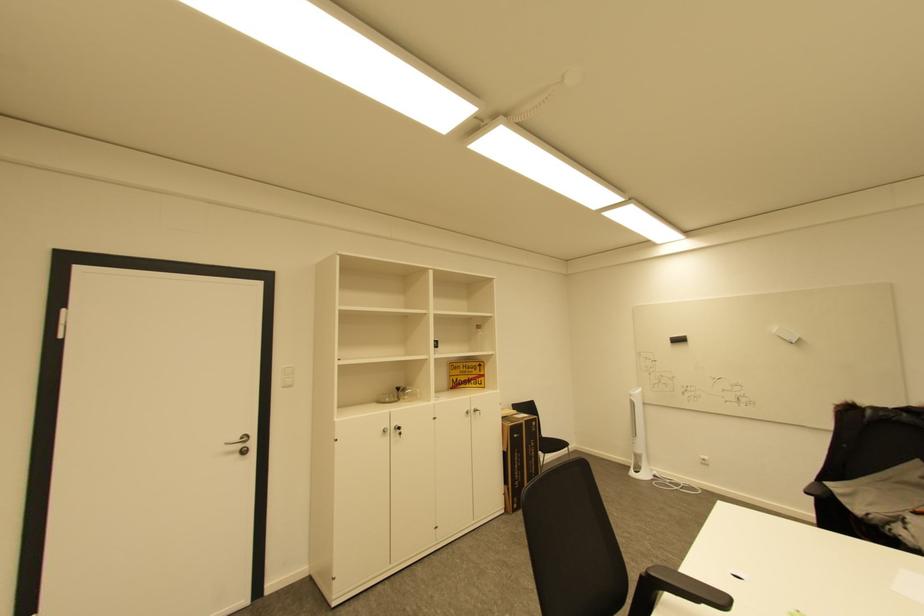
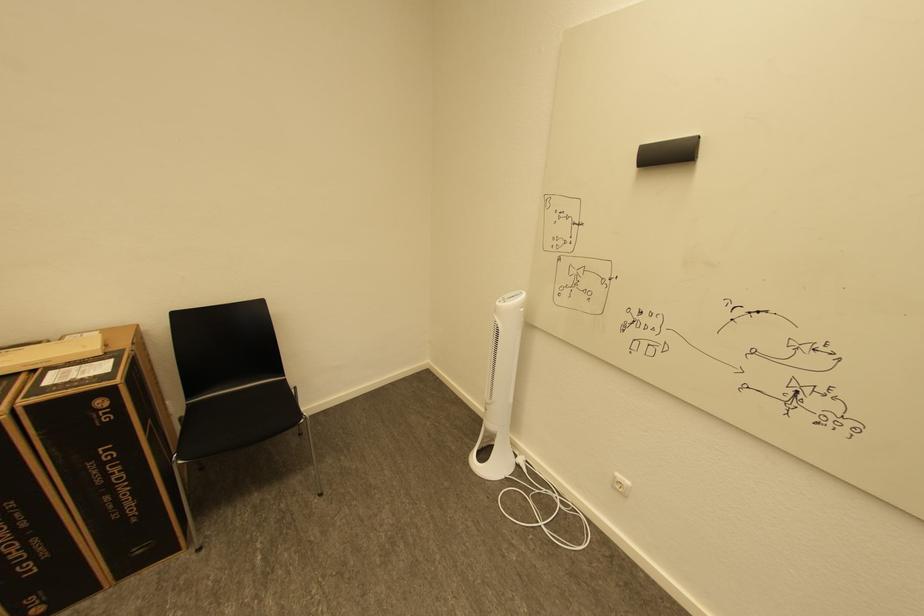
From the picture: In a continuous first-person perspective shot, in which direction is the camera moving?

The cameraman walked toward right, forward.